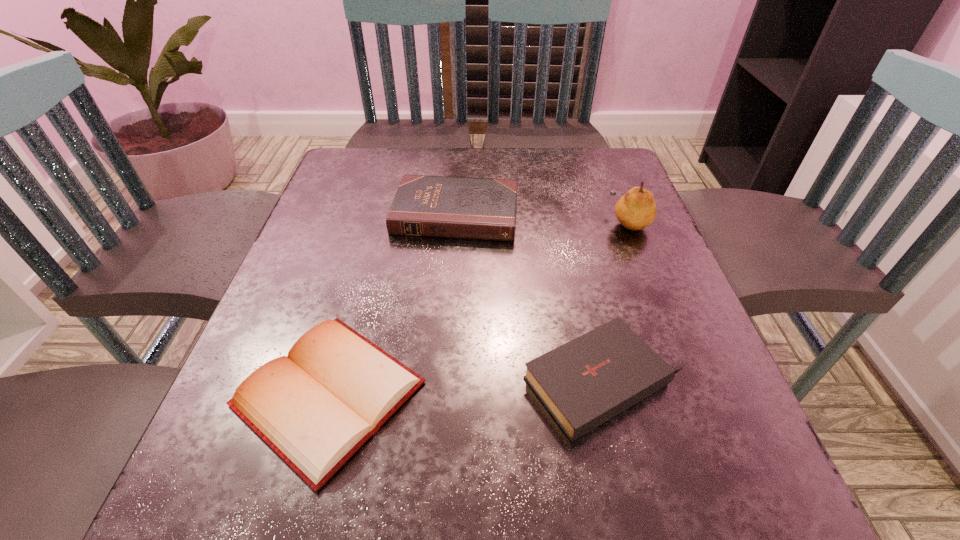
Locate an element on the screen. This screenshot has width=960, height=540. Bible located at the right edge is located at coordinates (587, 381).

The height and width of the screenshot is (540, 960). In order to click on object that is positioned at the near left corner in this screenshot , I will do `click(315, 407)`.

Find the location of `blank space at the far edge of the desktop`. blank space at the far edge of the desktop is located at coordinates (470, 155).

In the image, there is a desktop. At what (x,y) coordinates should I click in order to perform the action: click on free region at the near edge. Please return your answer as a coordinate pair (x, y). Image resolution: width=960 pixels, height=540 pixels. Looking at the image, I should click on (x=477, y=486).

Identify the location of free spot at the left edge of the desktop. The height and width of the screenshot is (540, 960). (281, 324).

Identify the location of free region at the right edge of the desktop. The width and height of the screenshot is (960, 540). (644, 338).

Find the location of a particular element. free space at the far left corner is located at coordinates (380, 166).

I want to click on free space at the far right corner of the desktop, so click(x=578, y=195).

In the image, there is a desktop. Where is `vacant region at the near right corner`? vacant region at the near right corner is located at coordinates (706, 499).

At what (x,y) coordinates should I click in order to perform the action: click on free space between the shortest Bible and the tallest object. Please return your answer as a coordinate pair (x, y). The height and width of the screenshot is (540, 960). Looking at the image, I should click on (479, 307).